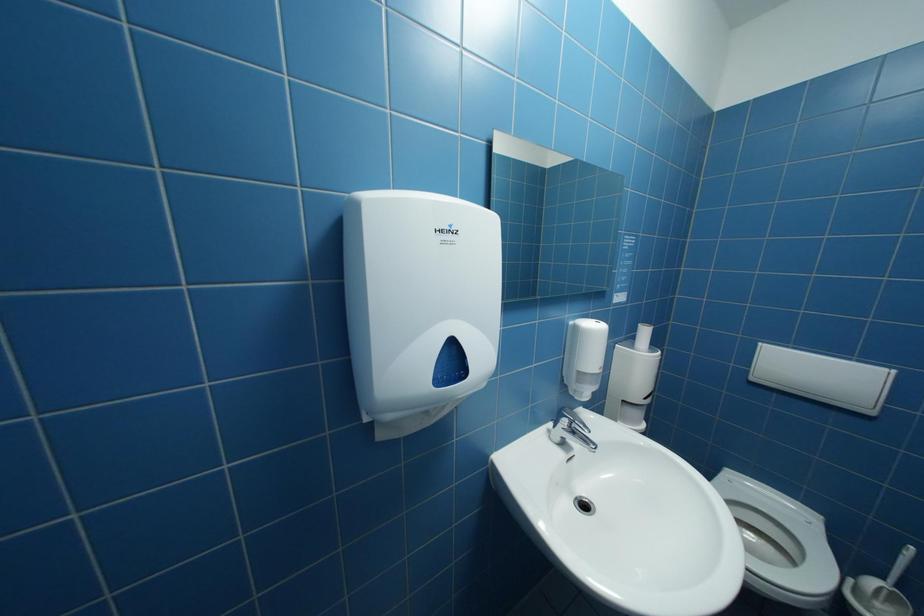
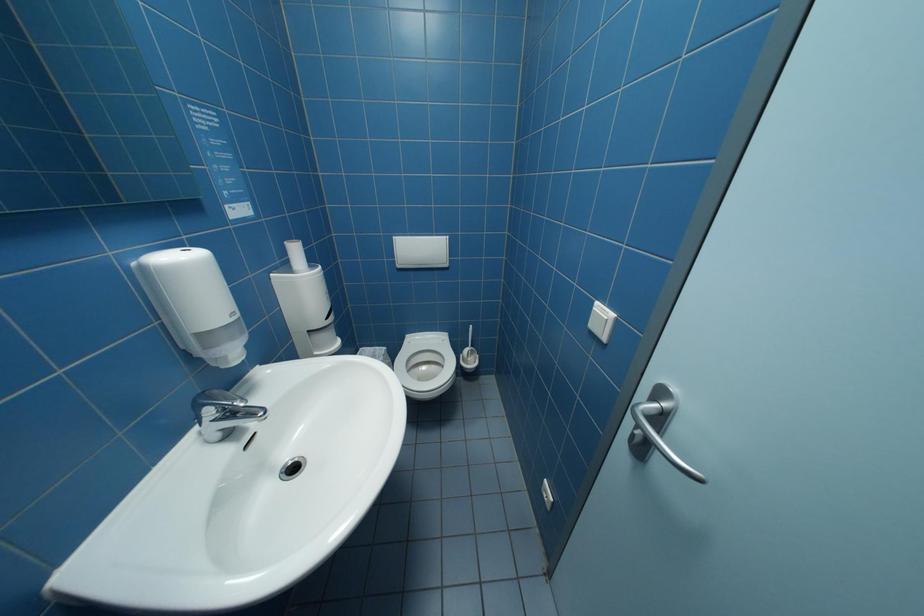
First-person continuous shooting, in which direction is the camera rotating?

The rotation direction of the camera is right-down.